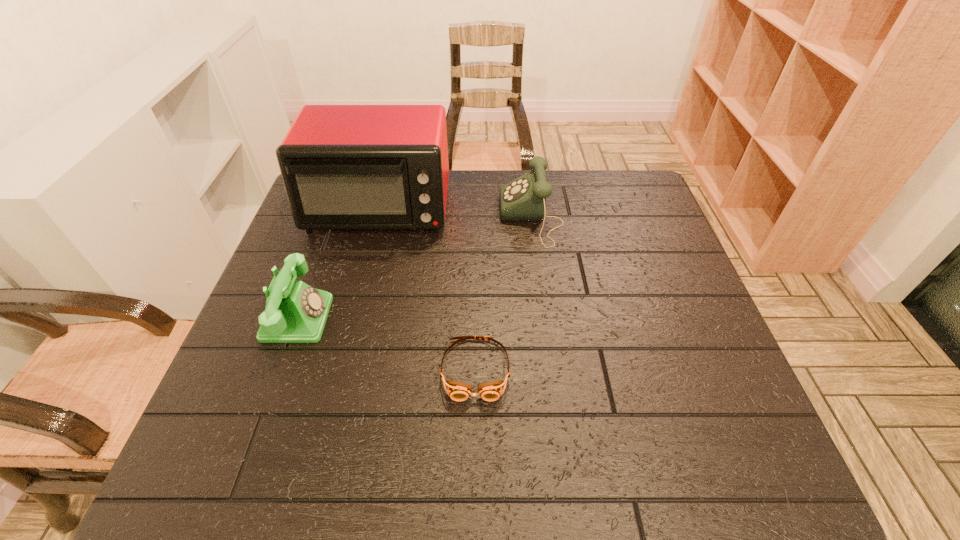
Where is `toaster oven that is at the far edge`? The width and height of the screenshot is (960, 540). toaster oven that is at the far edge is located at coordinates (345, 167).

What are the coordinates of `telephone that is at the far edge` in the screenshot? It's located at (523, 199).

Image resolution: width=960 pixels, height=540 pixels. I want to click on toaster oven present at the left edge, so click(x=345, y=167).

This screenshot has height=540, width=960. Identify the location of telephone positioned at the left edge. (295, 312).

Identify the location of object located in the far left corner section of the desktop. This screenshot has width=960, height=540. (345, 167).

Locate an element on the screen. vacant position at the far edge of the desktop is located at coordinates (523, 170).

The height and width of the screenshot is (540, 960). What are the coordinates of `vacant space at the left edge of the desktop` in the screenshot? It's located at (254, 355).

The image size is (960, 540). What are the coordinates of `blank space at the right edge of the desktop` in the screenshot? It's located at (660, 378).

The image size is (960, 540). In order to click on vacant space at the near left corner in this screenshot , I will do `click(206, 461)`.

At what (x,y) coordinates should I click in order to perform the action: click on free space at the far right corner of the desktop. Please return your answer as a coordinate pair (x, y). Image resolution: width=960 pixels, height=540 pixels. Looking at the image, I should click on (648, 187).